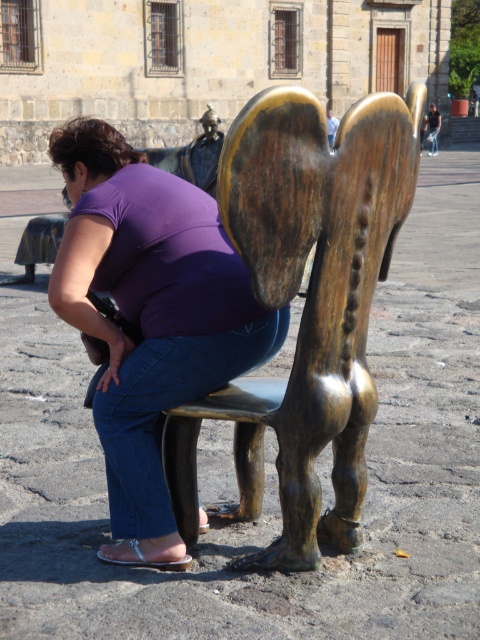
You are standing in the public square and see the bronze statue at center and the purple fabric at center. Which object is positioned higher from the ground?

The bronze statue at center is above the purple fabric at center, so it is higher from the ground.

You are an event organizer planning to place a 2 meter wide banner between the bronze statue at center and the purple fabric at center. Based on the scene description, will the space between them be wide enough to accommodate the banner?

The bronze statue at center is narrower than the purple fabric at center. However, the exact distance between them isn not specified in the provided information. Therefore, it is uncertain if the space between them can fit a 2 meter wide banner.